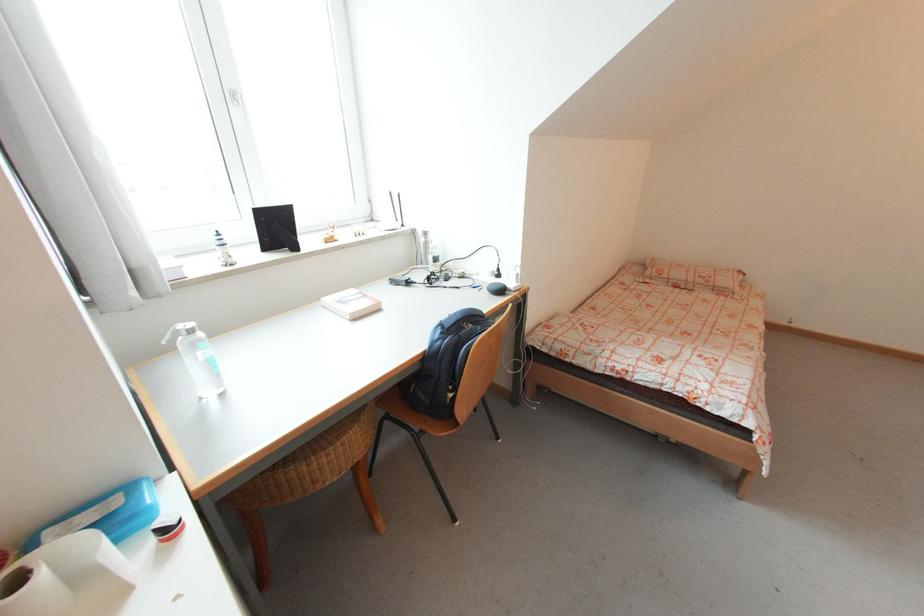
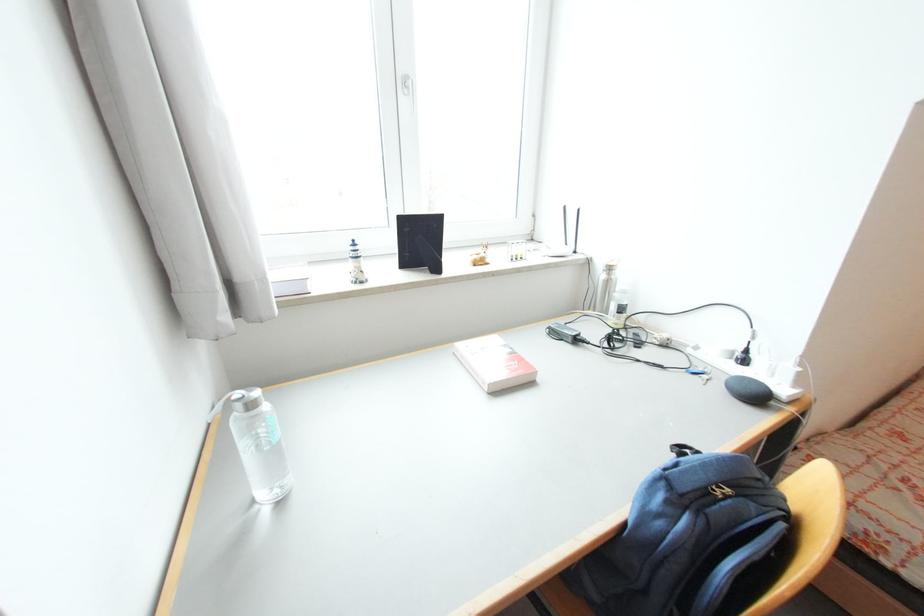
Find the pixel in the second image that matches pixel 476 326 in the first image.

(734, 492)